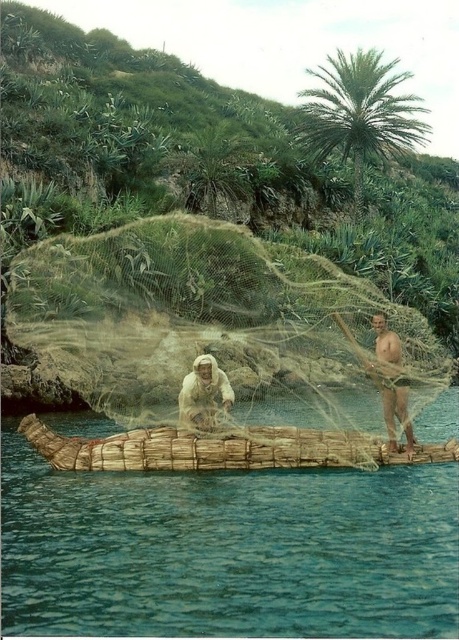
Question: Which object is positioned farthest from the green mesh fishing net at center?

Choices:
 (A) green leafy palm tree at upper center
 (B) brown wooden raft at center
 (C) white fabric at center

Answer: (A)

Question: Among these points, which one is farthest from the camera?

Choices:
 (A) (191, 440)
 (B) (370, 93)
 (C) (388, 445)
 (D) (365, 605)

Answer: (B)

Question: Considering the relative positions of brown wooden raft at center and green leafy palm tree at upper center in the image provided, where is brown wooden raft at center located with respect to green leafy palm tree at upper center?

Choices:
 (A) left
 (B) right

Answer: (A)

Question: Is green mesh fishing net at center wider than brown wooden pole at right?

Choices:
 (A) no
 (B) yes

Answer: (B)

Question: Does brown woven basket at center appear under white fabric at center?

Choices:
 (A) no
 (B) yes

Answer: (B)

Question: Which point is farther from the camera taking this photo?

Choices:
 (A) (404, 385)
 (B) (76, 445)

Answer: (A)